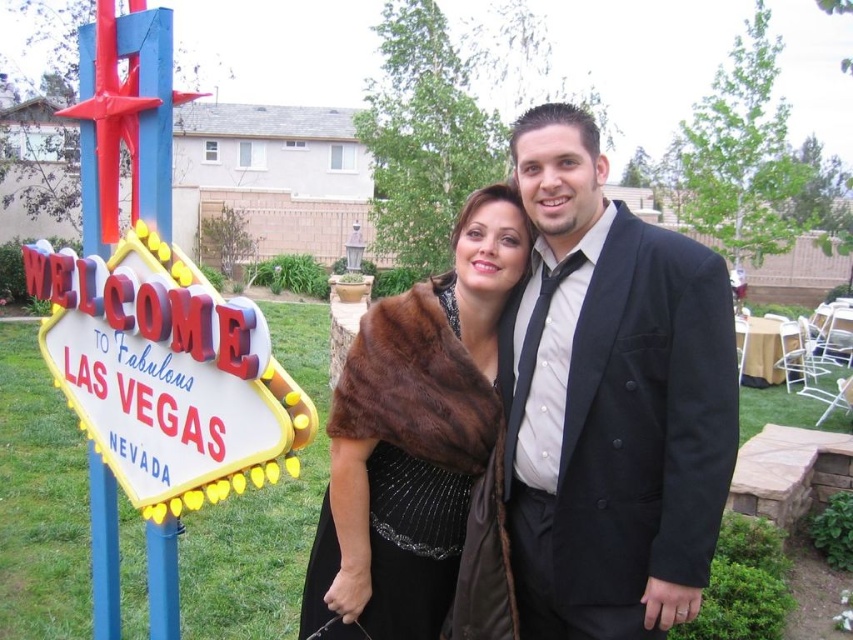
From the picture: You are a photographer who just took a picture of two people wearing a black satin suit at center and a brown fur shawl at center. The client wants to know which clothing item is covering the other in the photo. What do you tell them?

The black satin suit at center is positioned over the brown fur shawl at center, meaning the suit is covering the shawl in the photo.

You are a photographer trying to capture a shot of the brown fur shawl at center and the neon sign at left. Which object is positioned lower in the frame?

The brown fur shawl at center is located below the neon sign at left, so it is positioned lower in the frame.

You are a photographer who wants to take a picture of the black satin suit at center while ensuring it is centered in the frame. Based on its current position at point 0.627, 0.716, what adjustments should you make to the camera to center it?

To center the black satin suit at center, the camera should be moved slightly to the left and upwards since its current position is at coordinates (610,401). The center of the frame is at (426,320), so moving left reduces the x coordinate and moving up reduces the y coordinate.